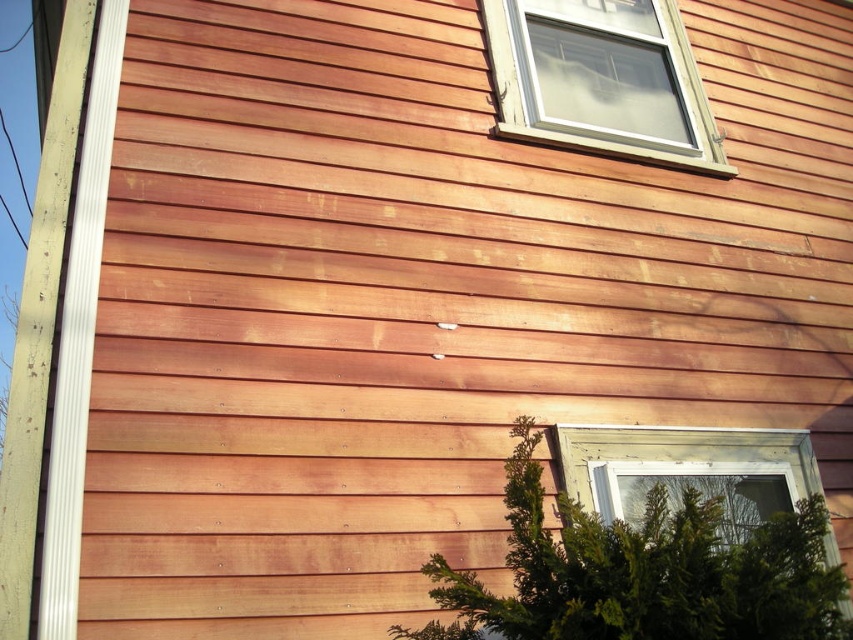
Who is higher up, white plastic window at upper right or clear glass window at lower right?

white plastic window at upper right is above.

In the scene shown: Does white plastic window at upper right lie behind clear glass window at lower right?

Yes, white plastic window at upper right is behind clear glass window at lower right.

Which is in front, point (683, 72) or point (775, 502)?

Point (775, 502)

At what (x,y) coordinates should I click in order to perform the action: click on white plastic window at upper right. Please return your answer as a coordinate pair (x, y). The height and width of the screenshot is (640, 853). Looking at the image, I should click on (601, 80).

Can you confirm if clear glass window at lower right is wider than white painted wood trim at left?

Yes.

In order to click on clear glass window at lower right in this screenshot , I will do `click(686, 468)`.

Is point (556, 17) in front of point (76, 275)?

No.

From the picture: Does white plastic window at upper right have a greater width compared to white painted wood trim at left?

Indeed, white plastic window at upper right has a greater width compared to white painted wood trim at left.

Which is behind, point (664, 58) or point (80, 221)?

The point (664, 58) is behind.

At what (x,y) coordinates should I click in order to perform the action: click on white plastic window at upper right. Please return your answer as a coordinate pair (x, y). The height and width of the screenshot is (640, 853). Looking at the image, I should click on (601, 80).